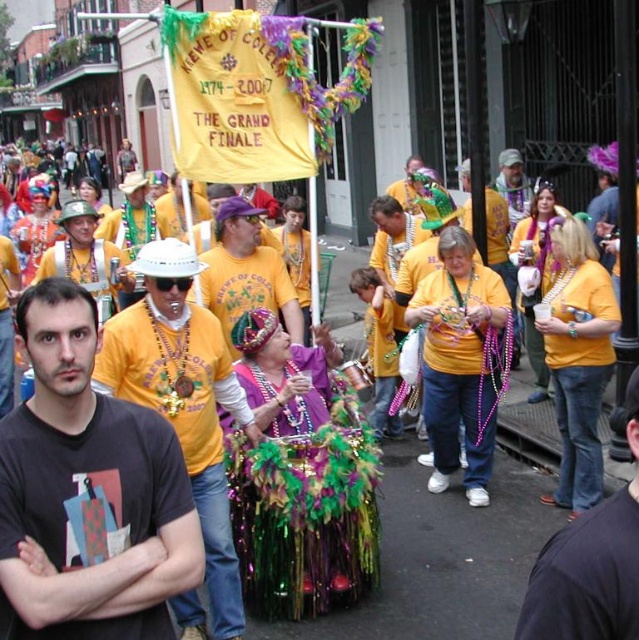
Question: Which point is farther from the camera taking this photo?

Choices:
 (A) (174, 332)
 (B) (132, 419)

Answer: (A)

Question: Does black matte t-shirt at center have a larger size compared to matte yellow shirt at center?

Choices:
 (A) yes
 (B) no

Answer: (B)

Question: Which object is farther from the camera taking this photo?

Choices:
 (A) black matte t-shirt at center
 (B) jeans at right
 (C) matte yellow shirt at center

Answer: (C)

Question: Where is black matte t-shirt at center located in relation to matte yellow shirt at center in the image?

Choices:
 (A) right
 (B) left

Answer: (B)

Question: Is matte yellow shirt at center smaller than jeans at right?

Choices:
 (A) yes
 (B) no

Answer: (B)

Question: Considering the real-world distances, which object is farthest from the jeans at right?

Choices:
 (A) black matte t-shirt at center
 (B) matte yellow shirt at center

Answer: (B)